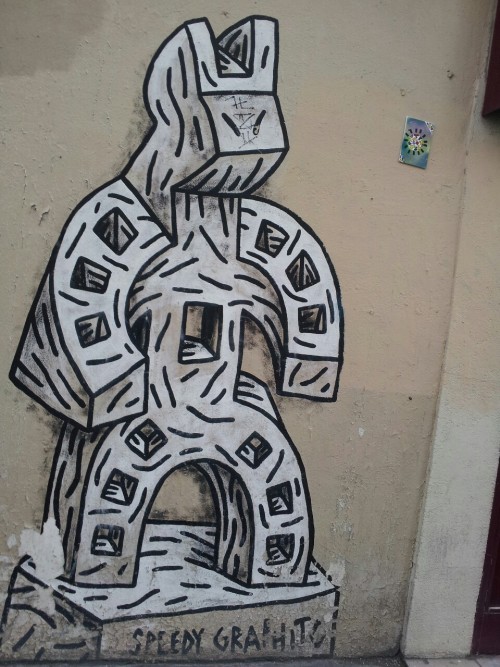
Locate an element on the screen. The height and width of the screenshot is (667, 500). the bottom edge of a wooden door is located at coordinates (488, 628).